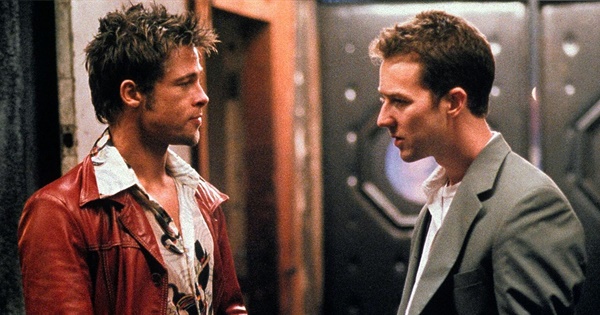
Where is `orange wall`? orange wall is located at coordinates (277, 81).